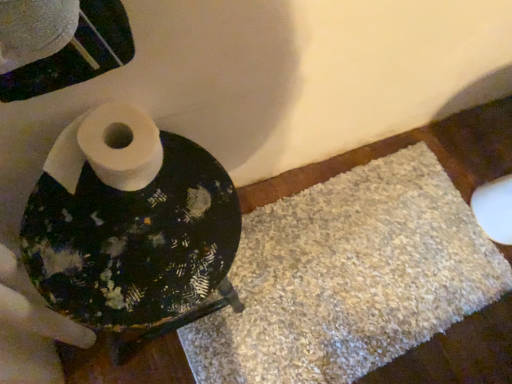
This screenshot has height=384, width=512. Identify the location of free point above white shaggy bath mat at lower right (from a real-world perspective). (351, 269).